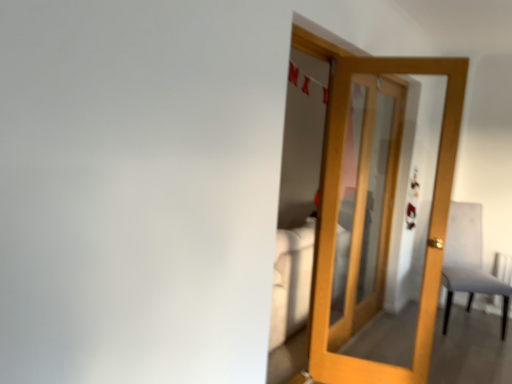
Question: Considering the relative positions of white fabric chair at right and wooden door at center in the image provided, is white fabric chair at right to the right of wooden door at center from the viewer's perspective?

Choices:
 (A) no
 (B) yes

Answer: (B)

Question: Considering the relative sizes of white fabric chair at right and wooden door at center in the image provided, is white fabric chair at right shorter than wooden door at center?

Choices:
 (A) yes
 (B) no

Answer: (A)

Question: From a real-world perspective, does white fabric chair at right sit lower than wooden door at center?

Choices:
 (A) no
 (B) yes

Answer: (B)

Question: From the image's perspective, does white fabric chair at right appear higher than wooden door at center?

Choices:
 (A) no
 (B) yes

Answer: (A)

Question: Does white fabric chair at right come in front of wooden door at center?

Choices:
 (A) yes
 (B) no

Answer: (B)

Question: Considering the relative sizes of white fabric chair at right and wooden door at center in the image provided, is white fabric chair at right taller than wooden door at center?

Choices:
 (A) no
 (B) yes

Answer: (A)

Question: Does wooden door at center appear on the left side of white fabric chair at right?

Choices:
 (A) yes
 (B) no

Answer: (A)

Question: Is the depth of wooden door at center less than that of white fabric chair at right?

Choices:
 (A) yes
 (B) no

Answer: (A)

Question: From a real-world perspective, does wooden door at center sit lower than white fabric chair at right?

Choices:
 (A) no
 (B) yes

Answer: (A)

Question: Can you confirm if wooden door at center is bigger than white fabric chair at right?

Choices:
 (A) no
 (B) yes

Answer: (A)

Question: Is wooden door at center at the right side of white fabric chair at right?

Choices:
 (A) yes
 (B) no

Answer: (B)

Question: Does wooden door at center have a greater width compared to white fabric chair at right?

Choices:
 (A) no
 (B) yes

Answer: (A)

Question: Considering the positions of wooden door at center and white fabric chair at right in the image, is wooden door at center wider or thinner than white fabric chair at right?

Choices:
 (A) thin
 (B) wide

Answer: (A)